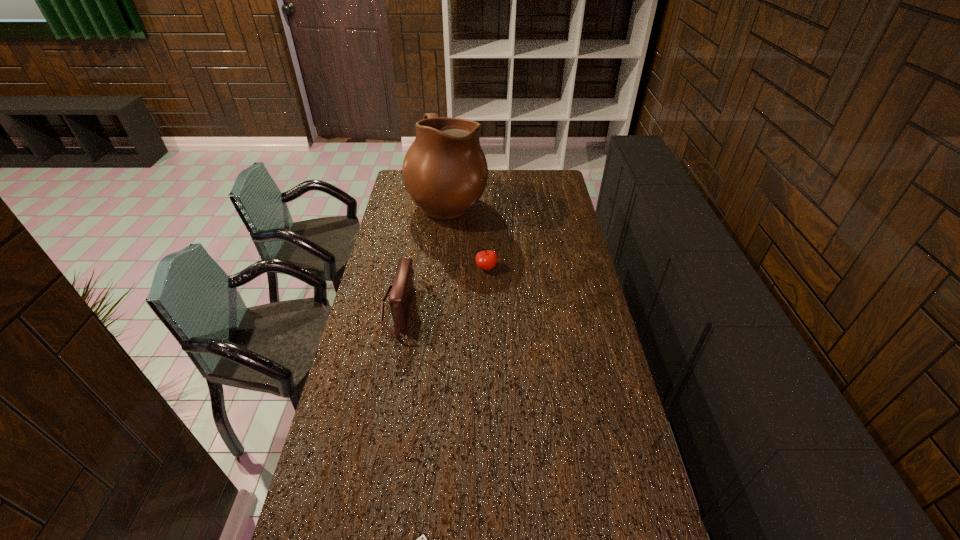
You are a GUI agent. You are given a task and a screenshot of the screen. Output one action in this format:
    pyautogui.click(x=<x>, y=<y>)
    Task: Click on the tallest object
    The image size is (960, 540).
    Given the screenshot: What is the action you would take?
    pyautogui.click(x=445, y=172)

The image size is (960, 540). In order to click on the farthest object in this screenshot , I will do `click(445, 172)`.

Locate an element on the screen. The width and height of the screenshot is (960, 540). the second nearest object is located at coordinates pos(402,288).

This screenshot has height=540, width=960. I want to click on the second tallest object, so click(402, 288).

This screenshot has height=540, width=960. Identify the location of the third tallest object. (487, 259).

This screenshot has height=540, width=960. Find the location of `apple`. apple is located at coordinates (487, 259).

Where is `blank space located 0.150m at the spout of the cream pitcher`? blank space located 0.150m at the spout of the cream pitcher is located at coordinates (516, 200).

Find the location of a particular element. The image size is (960, 540). free point located 0.050m on the front flap of the second nearest object is located at coordinates (426, 308).

At what (x,y) coordinates should I click in order to perform the action: click on free region located on the left of the apple. Please return your answer as a coordinate pair (x, y). The height and width of the screenshot is (540, 960). Looking at the image, I should click on (403, 267).

Locate an element on the screen. object that is at the far edge is located at coordinates (445, 172).